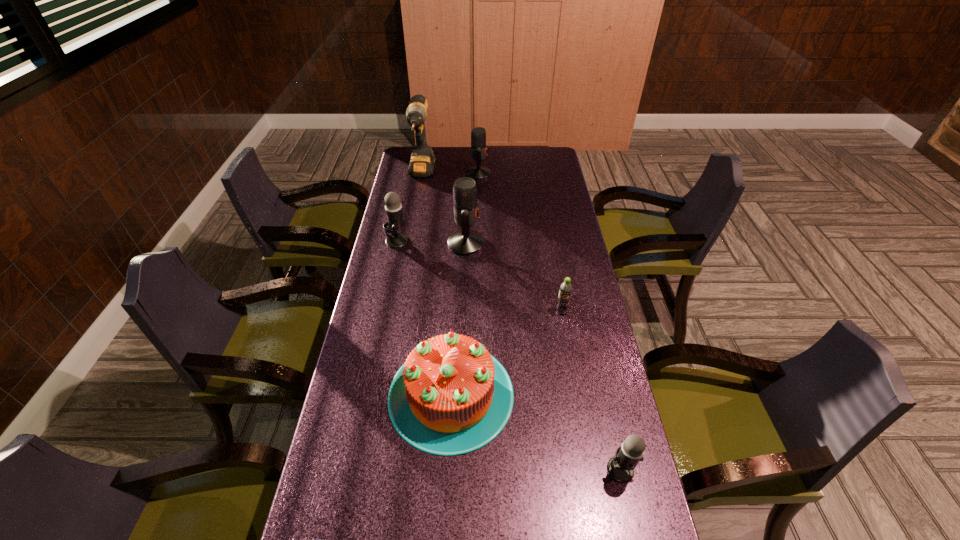
Identify the location of soda. The height and width of the screenshot is (540, 960). (564, 298).

Find the location of a particular element. This screenshot has height=540, width=960. the fourth nearest object is located at coordinates (564, 298).

This screenshot has width=960, height=540. Find the location of `free space located with the drill bit of the drill facing forward`. free space located with the drill bit of the drill facing forward is located at coordinates (410, 236).

Locate an element on the screen. Image resolution: width=960 pixels, height=540 pixels. vacant area situated on the side of the nearer red microphone with the red ring is located at coordinates (566, 244).

The width and height of the screenshot is (960, 540). I want to click on free space located 0.220m on the side of the farther red microphone with the red ring, so click(x=539, y=174).

You are a GUI agent. You are given a task and a screenshot of the screen. Output one action in this format:
    pyautogui.click(x=<x>, y=<y>)
    Task: Click on the free location located 0.380m on the back of the left gray microphone
    The height and width of the screenshot is (540, 960).
    Given the screenshot: What is the action you would take?
    pyautogui.click(x=409, y=181)

You are a GUI agent. You are given a task and a screenshot of the screen. Output one action in this format:
    pyautogui.click(x=<x>, y=<y>)
    Task: Click on the free spot located on the back of the cake
    The image size is (960, 540).
    Given the screenshot: What is the action you would take?
    pyautogui.click(x=456, y=294)

The image size is (960, 540). In order to click on free space located 0.260m on the left of the nearest microphone in this screenshot , I will do `click(499, 469)`.

Where is `vacant space located 0.280m on the front label of the soda`? The width and height of the screenshot is (960, 540). vacant space located 0.280m on the front label of the soda is located at coordinates (576, 393).

The image size is (960, 540). In order to click on drill that is at the far edge in this screenshot , I will do click(x=422, y=161).